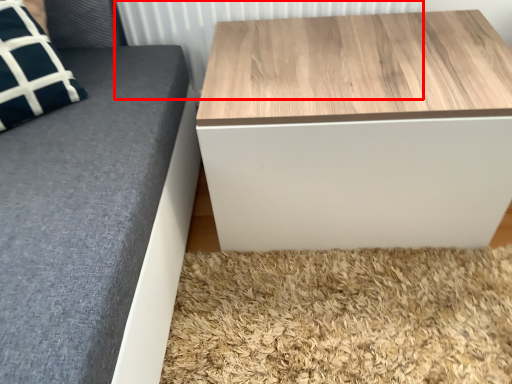
Question: From the image's perspective, where is radiator (annotated by the red box) located relative to table?

Choices:
 (A) above
 (B) below

Answer: (A)